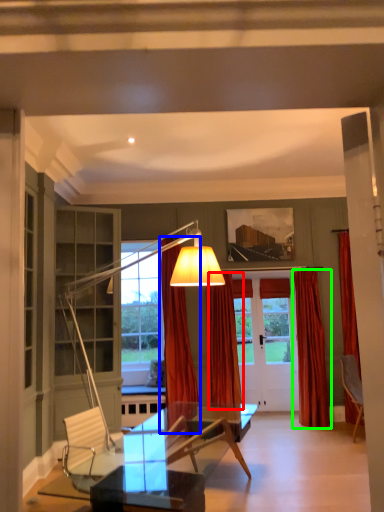
Question: Which object is the closest to the curtain (highlighted by a red box)? Choose among these: curtain (highlighted by a blue box) or curtain (highlighted by a green box).

Choices:
 (A) curtain
 (B) curtain

Answer: (A)